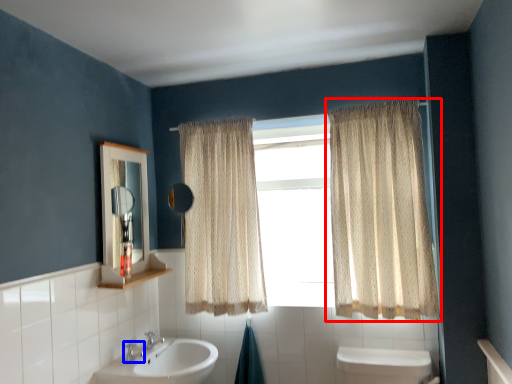
Question: Which point is further to the camera, curtain (highlighted by a red box) or plumbing fixture (highlighted by a blue box)?

Choices:
 (A) curtain
 (B) plumbing fixture

Answer: (B)